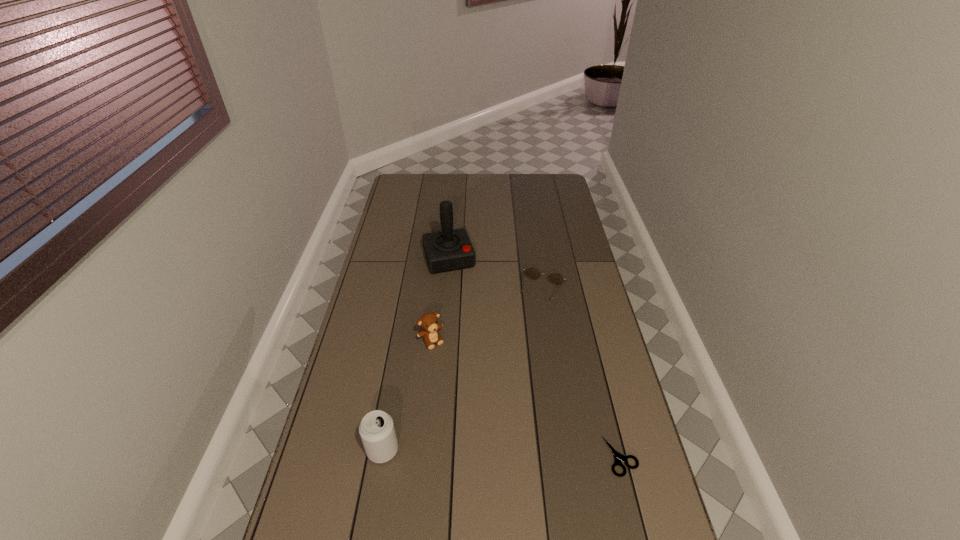
Find the location of a particular element. This screenshot has height=540, width=960. can is located at coordinates (377, 432).

Identify the location of the shortest object. (618, 457).

Identify the location of shears. (618, 457).

This screenshot has height=540, width=960. In order to click on spectacles in this screenshot , I will do `click(555, 278)`.

You are a GUI agent. You are given a task and a screenshot of the screen. Output one action in this format:
    pyautogui.click(x=<x>, y=<y>)
    Task: Click on the fourth nearest object
    The width and height of the screenshot is (960, 540).
    Given the screenshot: What is the action you would take?
    pyautogui.click(x=555, y=278)

Where is `joystick`? Image resolution: width=960 pixels, height=540 pixels. joystick is located at coordinates (450, 249).

Find the location of a particular element. The height and width of the screenshot is (540, 960). the farthest object is located at coordinates (450, 249).

The image size is (960, 540). Identify the location of teddy bear. (429, 321).

I want to click on the third shortest object, so click(429, 321).

Locate an element on the screen. free space located 0.300m on the back of the second tallest object is located at coordinates (399, 353).